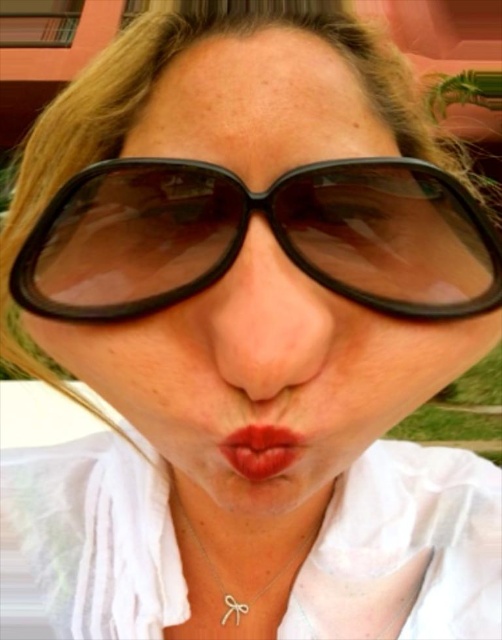
Question: Which point is closer to the camera taking this photo?

Choices:
 (A) (273, 269)
 (B) (269, 429)
 (C) (341, 221)
 (D) (230, 582)

Answer: (B)

Question: Can you confirm if black plastic sunglasses at center is positioned to the right of shiny red lips at center?

Choices:
 (A) yes
 (B) no

Answer: (B)

Question: Which is farther from the smooth flesh nose at center?

Choices:
 (A) shiny red lips at center
 (B) black plastic sunglasses at center
 (C) silver metallic bow at center

Answer: (C)

Question: Which of the following is the farthest from the observer?

Choices:
 (A) black plastic sunglasses at center
 (B) shiny red lips at center

Answer: (A)

Question: Can you confirm if smooth flesh nose at center is thinner than silver metallic bow at center?

Choices:
 (A) no
 (B) yes

Answer: (B)

Question: Is the position of smooth flesh nose at center more distant than that of silver metallic bow at center?

Choices:
 (A) no
 (B) yes

Answer: (A)